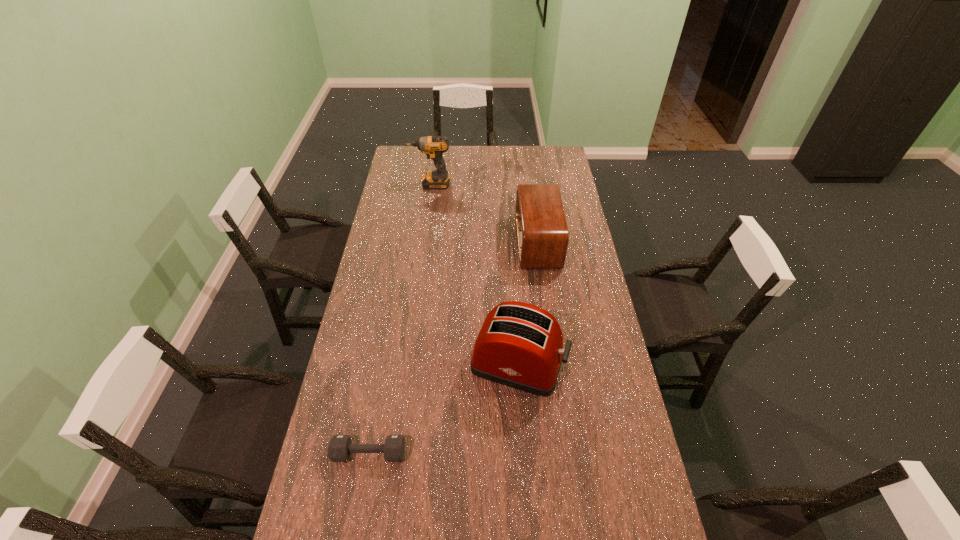
Where is `empty space between the farthest object and the toaster`? The image size is (960, 540). empty space between the farthest object and the toaster is located at coordinates (474, 274).

At what (x,y) coordinates should I click in order to perform the action: click on vacant space in between the farthest object and the second tallest object. Please return your answer as a coordinate pair (x, y). The height and width of the screenshot is (540, 960). Looking at the image, I should click on (474, 274).

Find the location of a particular element. Image resolution: width=960 pixels, height=540 pixels. free space that is in between the farthest object and the shortest object is located at coordinates (399, 319).

Identify the location of empty location between the third shortest object and the shortest object. The image size is (960, 540). click(444, 408).

Locate an element on the screen. This screenshot has width=960, height=540. free space between the third nearest object and the second nearest object is located at coordinates (528, 303).

At what (x,y) coordinates should I click in order to perform the action: click on empty space between the third nearest object and the dumbbell. Please return your answer as a coordinate pair (x, y). Looking at the image, I should click on (453, 348).

Identify the location of vacant area that lies between the third farthest object and the nearest object. This screenshot has height=540, width=960. (444, 408).

Find the location of a particular element. unoccupied area between the farthest object and the shortest object is located at coordinates (399, 319).

At what (x,y) coordinates should I click in order to perform the action: click on empty space between the toaster and the drill. Please return your answer as a coordinate pair (x, y). Looking at the image, I should click on (474, 274).

Identify which object is the nearest to the farthest object. Please provide its 2D coordinates. Your answer should be formatted as a tuple, i.e. [(x, y)], where the tuple contains the x and y coordinates of a point satisfying the conditions above.

[(542, 234)]